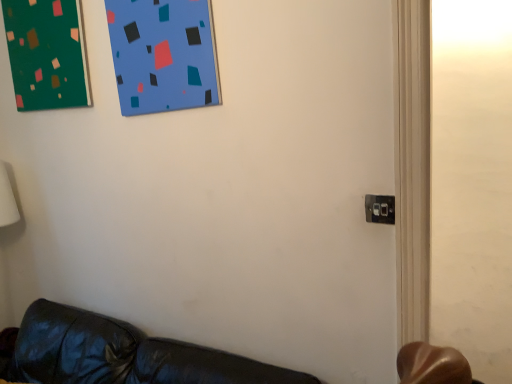
Question: From a real-world perspective, does black plastic electric outlet at lower right stand above green matte board at upper left?

Choices:
 (A) yes
 (B) no

Answer: (B)

Question: From a real-world perspective, is black plastic electric outlet at lower right beneath green matte board at upper left?

Choices:
 (A) no
 (B) yes

Answer: (B)

Question: Would you consider black plastic electric outlet at lower right to be distant from green matte board at upper left?

Choices:
 (A) yes
 (B) no

Answer: (A)

Question: From the image's perspective, is black plastic electric outlet at lower right over green matte board at upper left?

Choices:
 (A) yes
 (B) no

Answer: (B)

Question: Considering the relative sizes of black plastic electric outlet at lower right and green matte board at upper left in the image provided, is black plastic electric outlet at lower right taller than green matte board at upper left?

Choices:
 (A) no
 (B) yes

Answer: (A)

Question: Can you confirm if black plastic electric outlet at lower right is thinner than green matte board at upper left?

Choices:
 (A) yes
 (B) no

Answer: (A)

Question: Does green matte board at upper left have a larger size compared to black plastic electric outlet at lower right?

Choices:
 (A) no
 (B) yes

Answer: (B)

Question: From a real-world perspective, is green matte board at upper left physically below black plastic electric outlet at lower right?

Choices:
 (A) no
 (B) yes

Answer: (A)

Question: Can you confirm if green matte board at upper left is positioned to the left of black plastic electric outlet at lower right?

Choices:
 (A) no
 (B) yes

Answer: (B)

Question: Is green matte board at upper left facing away from black plastic electric outlet at lower right?

Choices:
 (A) yes
 (B) no

Answer: (B)

Question: From the image's perspective, is green matte board at upper left under black plastic electric outlet at lower right?

Choices:
 (A) yes
 (B) no

Answer: (B)

Question: Considering the relative sizes of green matte board at upper left and black plastic electric outlet at lower right in the image provided, is green matte board at upper left shorter than black plastic electric outlet at lower right?

Choices:
 (A) no
 (B) yes

Answer: (A)

Question: From the image's perspective, is black plastic electric outlet at lower right above or below green matte board at upper left?

Choices:
 (A) above
 (B) below

Answer: (B)